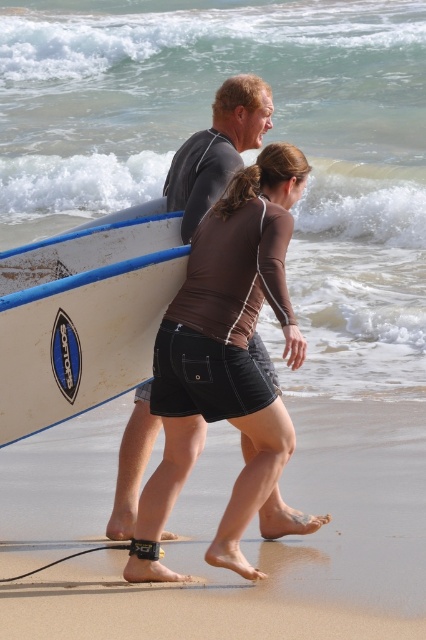
You are standing at the camera position and want to throw a small pebble to hit the black fabric shorts at center. Considering the distance is 14.20 feet, can you estimate if a typical adult can throw a pebble that far?

The distance between the black fabric shorts at center and the camera is 14.20 feet. A typical adult can throw a pebble that far, so yes, it is possible.

You are a photographer on the beach and want to capture both the brown matte shorts at center and the white matte surfboard at left in the same frame. Based on their positions, which object should you focus on first to ensure both are in the shot?

The brown matte shorts at center is below the white matte surfboard at left, so you should focus on the white matte surfboard at left first to ensure both are in the frame.